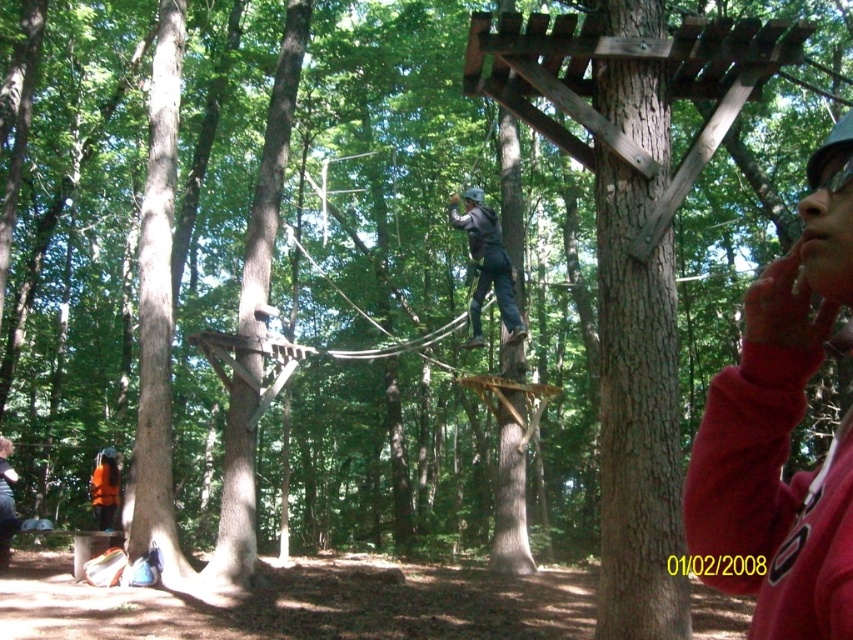
Question: Estimate the real-world distances between objects in this image. Which object is farther from the dark gray fabric harness at center?

Choices:
 (A) orange life vest at lower left
 (B) matte red sweatshirt at upper right

Answer: (B)

Question: Is matte red sweatshirt at upper right bigger than orange life vest at lower left?

Choices:
 (A) yes
 (B) no

Answer: (A)

Question: Which object is the closest to the matte red sweatshirt at upper right?

Choices:
 (A) orange life vest at lower left
 (B) dark gray fabric harness at center

Answer: (B)

Question: Observing the image, what is the correct spatial positioning of matte red sweatshirt at upper right in reference to dark gray fabric harness at center?

Choices:
 (A) left
 (B) right

Answer: (B)

Question: Can you confirm if matte red sweatshirt at upper right is wider than orange fabric backpack at lower left?

Choices:
 (A) yes
 (B) no

Answer: (A)

Question: Among these objects, which one is nearest to the camera?

Choices:
 (A) orange life vest at lower left
 (B) dark gray fabric harness at center
 (C) matte red sweatshirt at upper right

Answer: (C)